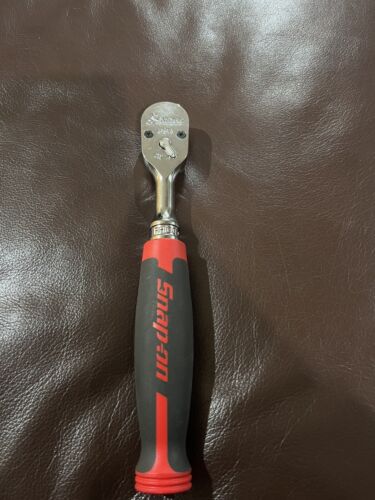
This screenshot has height=500, width=375. What are the coordinates of `leather upholstery` in the screenshot? It's located at (168, 255), (72, 175), (281, 272).